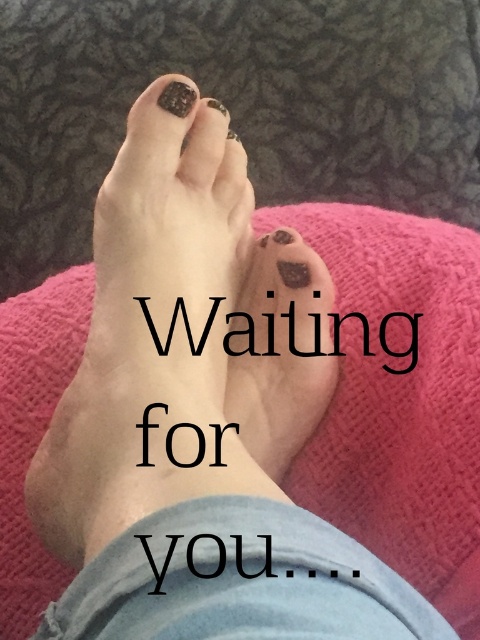
You are a nail technician observing the image. You see the matte black toenail at center and the matte black toenail polish at center. Which object is wider?

The matte black toenail at center is wider than the matte black toenail polish at center.

You are a nail technician preparing to apply a decorative sticker between the matte black toenail at center and the matte black toe at center. The sticker requires 4 inches of space. Can the sticker fit in the space between them?

The distance between the matte black toenail at center and the matte black toe at center is 4.13 inches, which is sufficient for the sticker requiring 4 inches of space. Therefore, the sticker can fit between them.

You are a nail technician observing the image. You need to place a new bottle of matte black toenail polish at center so it doesn not interfere with the existing matte black toenail at center. Based on their positions, which side of the existing toenail should you place the new polish bottle?

The matte black toenail at center is on the left side of the matte black toenail polish at center. Therefore, to avoid interference, place the new bottle of matte black toenail polish at center to the right side of the existing matte black toenail at center.